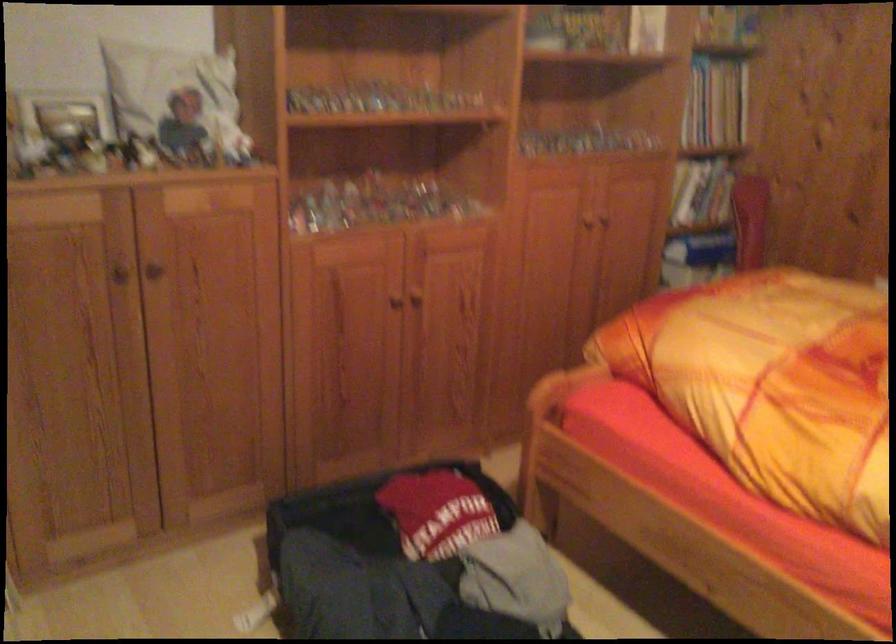
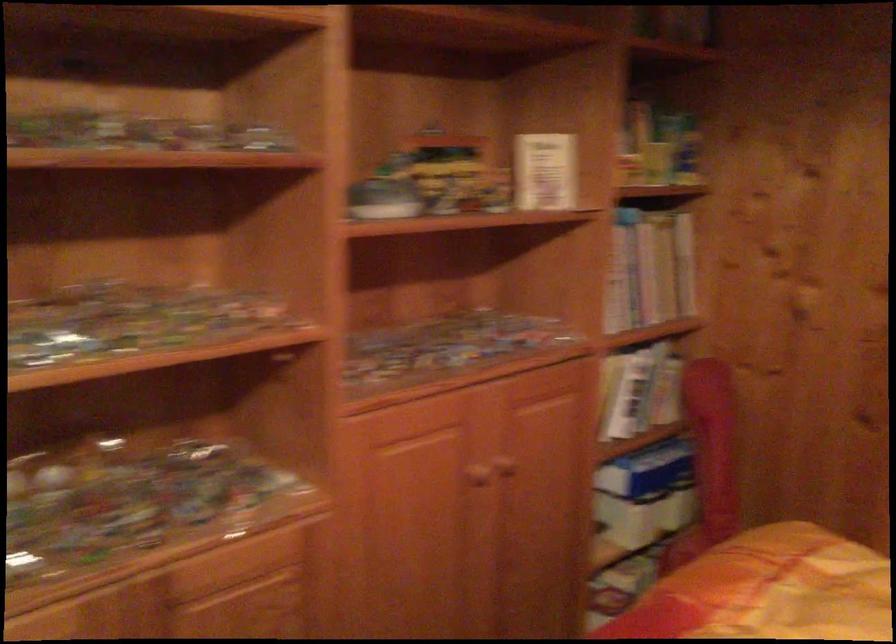
Question: The images are taken continuously from a first-person perspective. In which direction are you moving?

Choices:
 (A) Left
 (B) Right
 (C) Forward
 (D) Backward

Answer: (C)